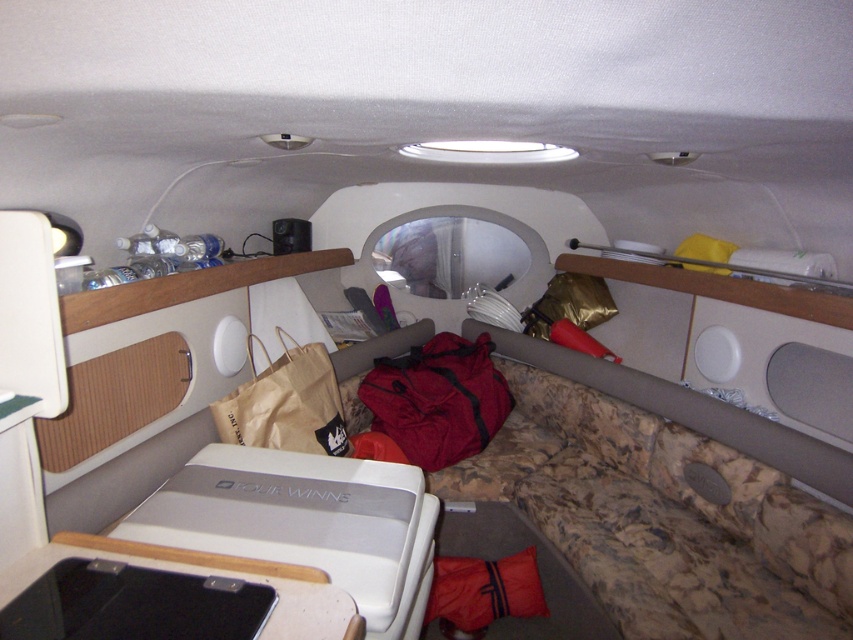
Question: Which object appears farthest from the camera in this image?

Choices:
 (A) red fabric bag at center
 (B) brown paper bag at center

Answer: (A)

Question: Is red fabric bag at center to the right of brown paper bag at center from the viewer's perspective?

Choices:
 (A) no
 (B) yes

Answer: (B)

Question: Is the position of red fabric bag at center more distant than that of brown paper bag at center?

Choices:
 (A) no
 (B) yes

Answer: (B)

Question: Which point appears farthest from the camera in this image?

Choices:
 (A) (383, 401)
 (B) (281, 419)

Answer: (A)

Question: Which of the following is the farthest from the observer?

Choices:
 (A) (306, 394)
 (B) (440, 406)

Answer: (B)

Question: Can you confirm if red fabric bag at center is positioned to the left of brown paper bag at center?

Choices:
 (A) no
 (B) yes

Answer: (A)